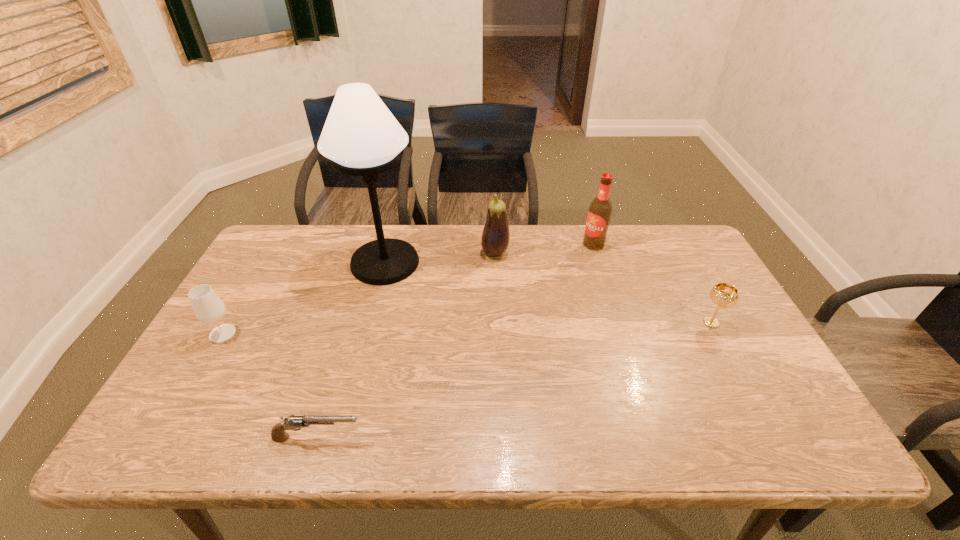
This screenshot has width=960, height=540. In order to click on vacant space that's between the nearest object and the eggplant in this screenshot , I will do `click(406, 345)`.

This screenshot has height=540, width=960. Find the location of `empty space that is in between the fourth object from left to right and the chalice`. empty space that is in between the fourth object from left to right and the chalice is located at coordinates (603, 288).

Where is `free space between the beer bottle and the rightmost object`? Image resolution: width=960 pixels, height=540 pixels. free space between the beer bottle and the rightmost object is located at coordinates (652, 284).

What are the coordinates of `free space between the leftmost object and the fourth object from left to right` in the screenshot? It's located at (359, 293).

Point out which object is positioned as the third nearest to the second object from right to left. Please provide its 2D coordinates. Your answer should be formatted as a tuple, i.e. [(x, y)], where the tuple contains the x and y coordinates of a point satisfying the conditions above.

[(361, 137)]

Select which object appears as the closest to the leftmost object. Please provide its 2D coordinates. Your answer should be formatted as a tuple, i.e. [(x, y)], where the tuple contains the x and y coordinates of a point satisfying the conditions above.

[(361, 137)]